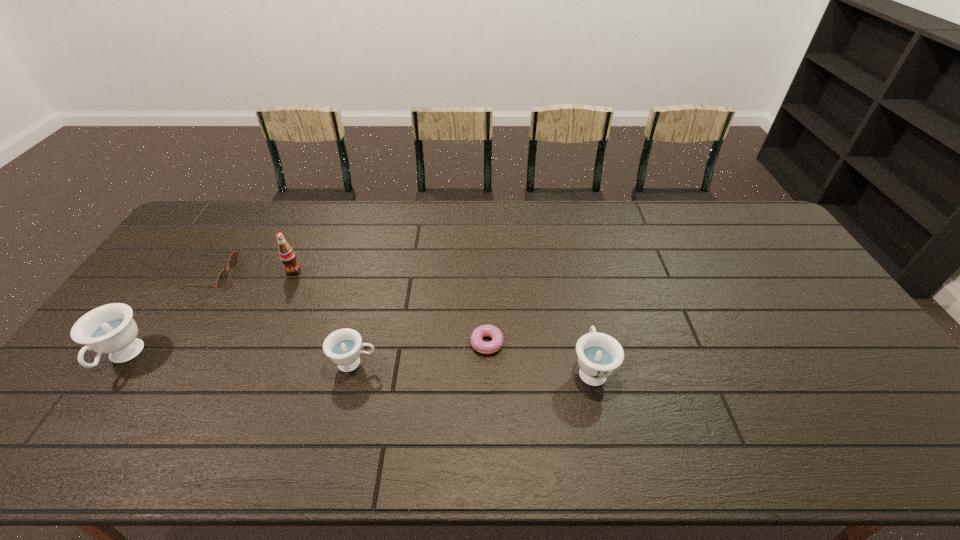
Identify the location of the leftmost teacup. This screenshot has width=960, height=540. coord(110,329).

The width and height of the screenshot is (960, 540). Find the location of `the third object from right to left`. the third object from right to left is located at coordinates 343,346.

This screenshot has width=960, height=540. I want to click on the shortest teacup, so click(343, 346).

Locate an element on the screen. Image resolution: width=960 pixels, height=540 pixels. the rightmost object is located at coordinates (599, 354).

The image size is (960, 540). In order to click on the rightmost teacup in this screenshot , I will do [599, 354].

Where is `the tallest object`? The image size is (960, 540). the tallest object is located at coordinates (286, 253).

Identify the location of soda. Image resolution: width=960 pixels, height=540 pixels. (286, 253).

Identify the location of the second object from right to left. This screenshot has height=540, width=960. (478, 344).

In order to click on the shortest object in this screenshot , I will do `click(478, 344)`.

Locate an element on the screen. the fifth tallest object is located at coordinates (222, 278).